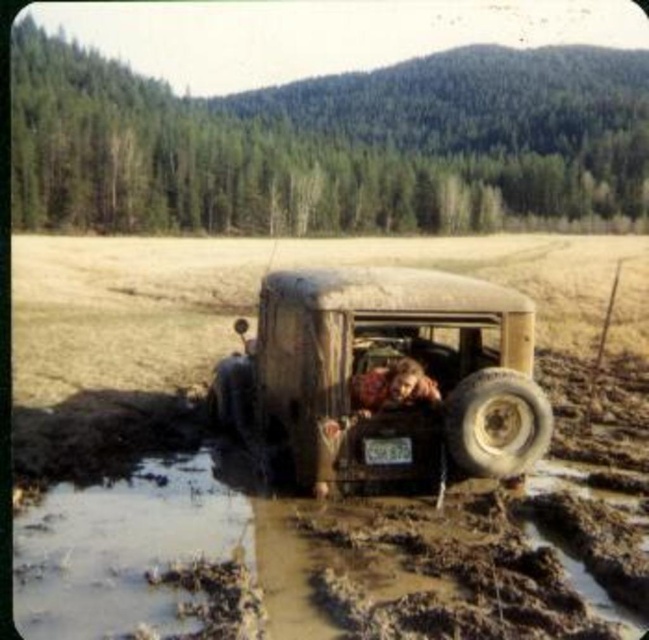
Question: Is light brown rubber tire at lower right smaller than brown leather jacket at rear center?

Choices:
 (A) no
 (B) yes

Answer: (A)

Question: Does muddy rubber truck at center appear on the left side of brown leather jacket at rear center?

Choices:
 (A) yes
 (B) no

Answer: (B)

Question: Which object is farther from the camera taking this photo?

Choices:
 (A) light brown rubber tire at lower right
 (B) brown leather jacket at rear center
 (C) muddy rubber truck at center

Answer: (B)

Question: Is light brown rubber tire at lower right to the right of brown leather jacket at rear center from the viewer's perspective?

Choices:
 (A) no
 (B) yes

Answer: (B)

Question: Which point is farther to the camera?

Choices:
 (A) brown leather jacket at rear center
 (B) muddy rubber truck at center
 (C) light brown rubber tire at lower right

Answer: (A)

Question: Which object appears farthest from the camera in this image?

Choices:
 (A) muddy rubber truck at center
 (B) brown leather jacket at rear center

Answer: (B)